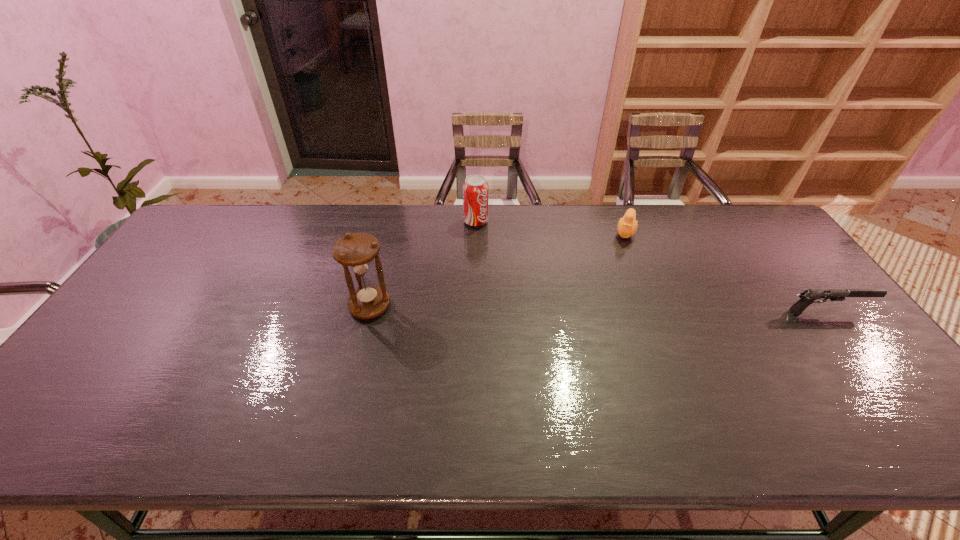
I want to click on empty location between the third object from left to right and the tallest object, so click(497, 269).

Locate which object is the second closest to the gun. Please provide its 2D coordinates. Your answer should be formatted as a tuple, i.e. [(x, y)], where the tuple contains the x and y coordinates of a point satisfying the conditions above.

[(475, 188)]

Locate an element on the screen. the third closest object relative to the soda can is located at coordinates (807, 297).

The height and width of the screenshot is (540, 960). Identify the location of vacant area in the image that satisfies the following two spatial constraints: 1. on the back side of the duckling; 2. on the left side of the hourglass. (388, 232).

Locate an element on the screen. This screenshot has height=540, width=960. vacant space that satisfies the following two spatial constraints: 1. on the front side of the duckling; 2. on the right side of the second object from left to right is located at coordinates (476, 232).

Where is `free location that satisfies the following two spatial constraints: 1. on the front side of the tallest object; 2. at the muzzle end of the rightmost object`? The height and width of the screenshot is (540, 960). free location that satisfies the following two spatial constraints: 1. on the front side of the tallest object; 2. at the muzzle end of the rightmost object is located at coordinates (369, 312).